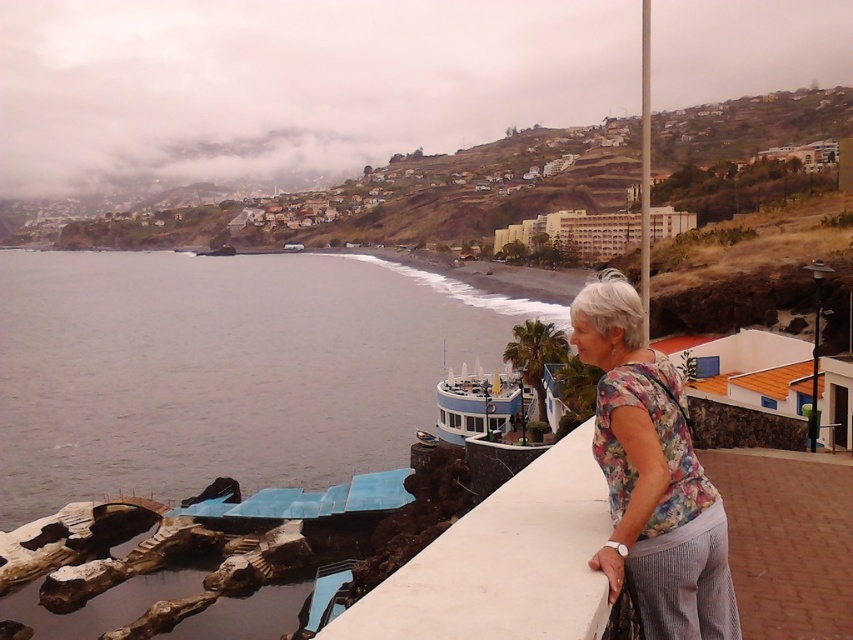
Question: Is gray water at lower left above floral fabric blouse at right?

Choices:
 (A) no
 (B) yes

Answer: (B)

Question: Does gray water at lower left come in front of white concrete ledge at lower right?

Choices:
 (A) yes
 (B) no

Answer: (B)

Question: Which of the following is the farthest from the observer?

Choices:
 (A) white concrete ledge at lower right
 (B) floral fabric blouse at right

Answer: (B)

Question: Which of the following is the closest to the observer?

Choices:
 (A) white concrete ledge at lower right
 (B) gray water at lower left

Answer: (A)

Question: Which of the following is the closest to the observer?

Choices:
 (A) white concrete ledge at lower right
 (B) gray water at lower left
 (C) floral fabric blouse at right

Answer: (A)

Question: Observing the image, what is the correct spatial positioning of gray water at lower left in reference to floral fabric blouse at right?

Choices:
 (A) right
 (B) left

Answer: (B)